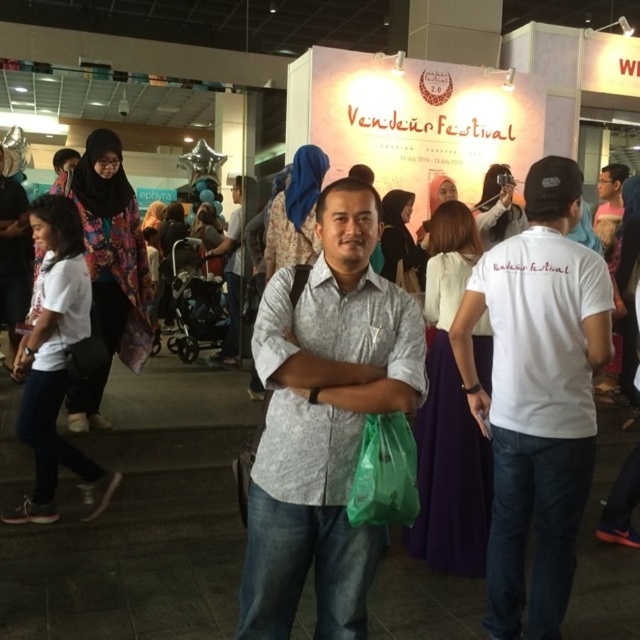
Is purple satin dress at center closer to the viewer compared to white matte shirt at left?

Yes, it is in front of white matte shirt at left.

The image size is (640, 640). What do you see at coordinates (449, 416) in the screenshot?
I see `purple satin dress at center` at bounding box center [449, 416].

The image size is (640, 640). I want to click on purple satin dress at center, so click(449, 416).

Is point (524, 348) farther from viewer compared to point (225, 337)?

No, it is not.

Does white cotton t-shirt at center lie in front of white textured shirt at center?

Yes, it is in front of white textured shirt at center.

Between point (536, 252) and point (241, 195), which one is positioned behind?

Positioned behind is point (241, 195).

This screenshot has height=640, width=640. I want to click on white cotton t-shirt at center, so click(x=536, y=396).

Which of these two, white matte shirt at left or matte white shirt at upper right, stands shorter?

With less height is matte white shirt at upper right.

From the picture: Is white matte shirt at left to the left of matte white shirt at upper right from the viewer's perspective?

Indeed, white matte shirt at left is positioned on the left side of matte white shirt at upper right.

Describe the element at coordinates (54, 364) in the screenshot. I see `white matte shirt at left` at that location.

Where is `white matte shirt at left`? This screenshot has width=640, height=640. white matte shirt at left is located at coordinates (54, 364).